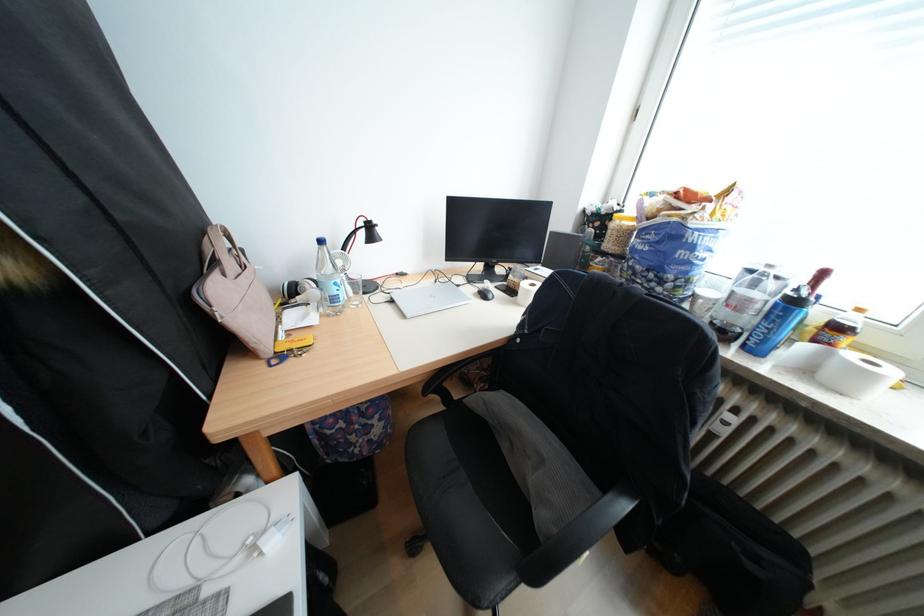
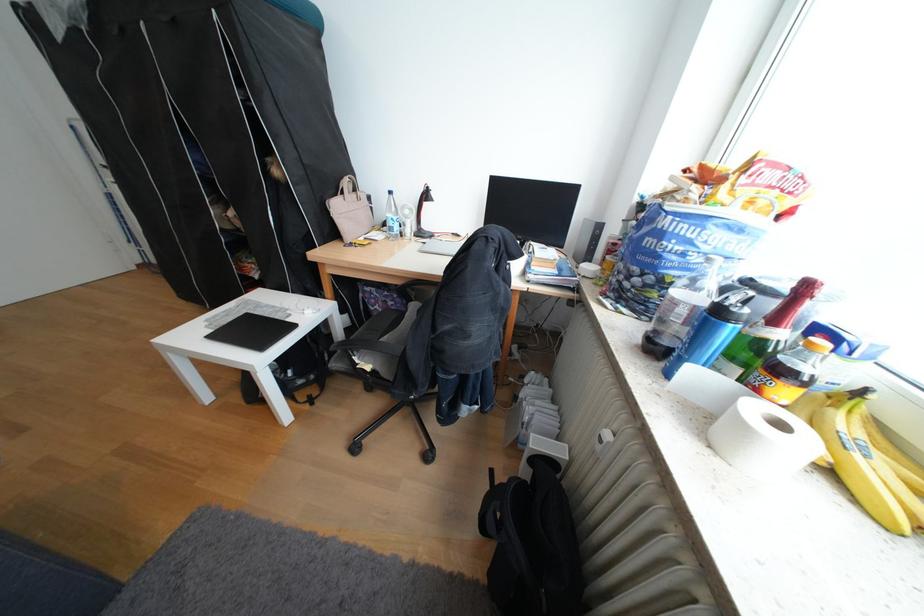
In the second image, find the point that corresponds to pixel 835 275 in the first image.

(819, 288)